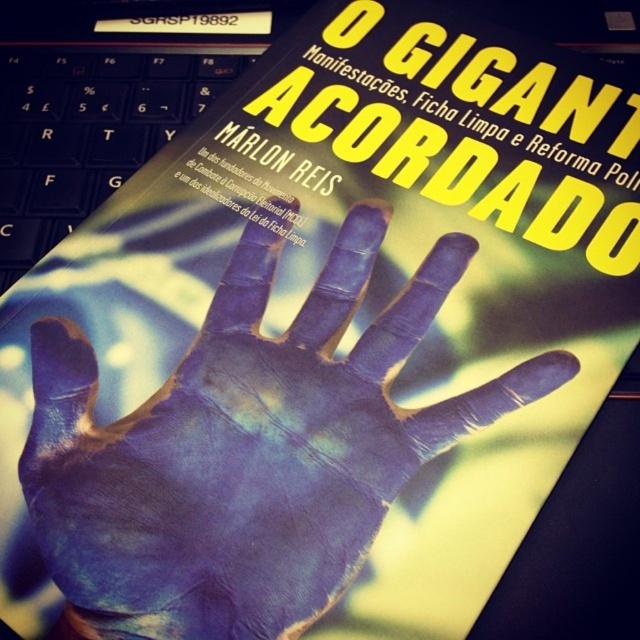
Can you confirm if blue painted hand at center is shorter than black plastic keyboard at upper left?

No, blue painted hand at center is not shorter than black plastic keyboard at upper left.

Is blue painted hand at center to the left of black plastic keyboard at upper left from the viewer's perspective?

Incorrect, blue painted hand at center is not on the left side of black plastic keyboard at upper left.

Is point (332, 384) closer to camera compared to point (44, 76)?

Yes, it is.

What are the coordinates of `blue painted hand at center` in the screenshot? It's located at (246, 448).